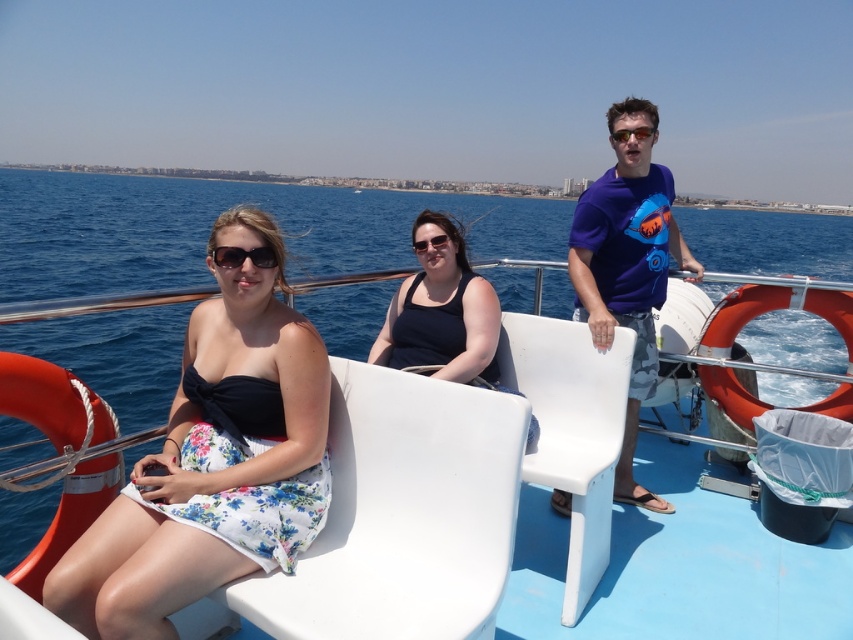
Question: Is blue cotton t-shirt at right to the right of black matte tank top at center from the viewer's perspective?

Choices:
 (A) no
 (B) yes

Answer: (B)

Question: Which of the following is the closest to the observer?

Choices:
 (A) (451, 308)
 (B) (346, 433)
 (C) (236, 248)

Answer: (C)

Question: Does white plastic chair at center come behind clear plastic goggles at center?

Choices:
 (A) no
 (B) yes

Answer: (A)

Question: Among these objects, which one is farthest from the camera?

Choices:
 (A) black matte tank top at center
 (B) transparent plastic goggles at center
 (C) blue cotton t-shirt at right

Answer: (B)

Question: Among these objects, which one is nearest to the camera?

Choices:
 (A) white plastic chair at center
 (B) black matte tank top at center
 (C) transparent plastic goggles at center

Answer: (A)

Question: Where is matte black dress at center located in relation to black matte tank top at center in the image?

Choices:
 (A) left
 (B) right

Answer: (A)